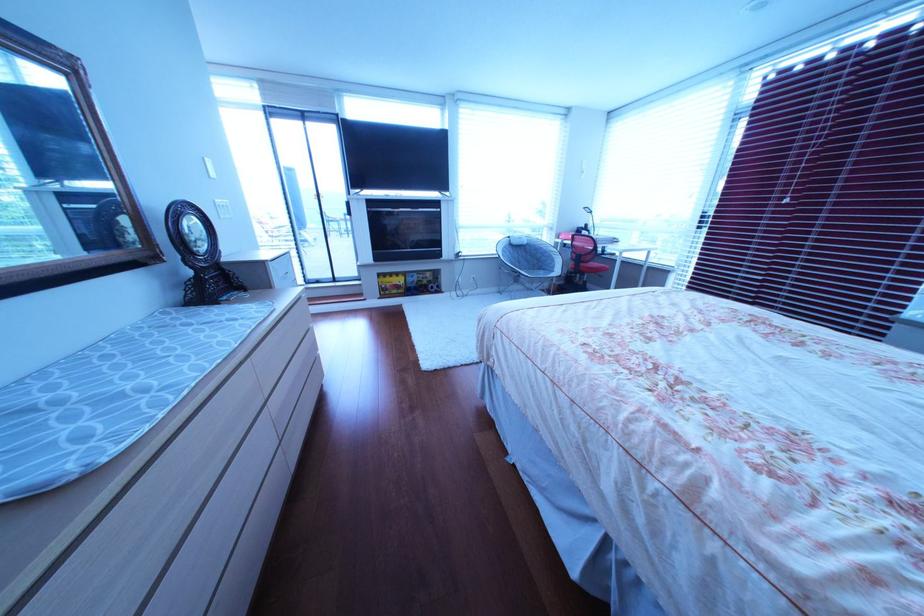
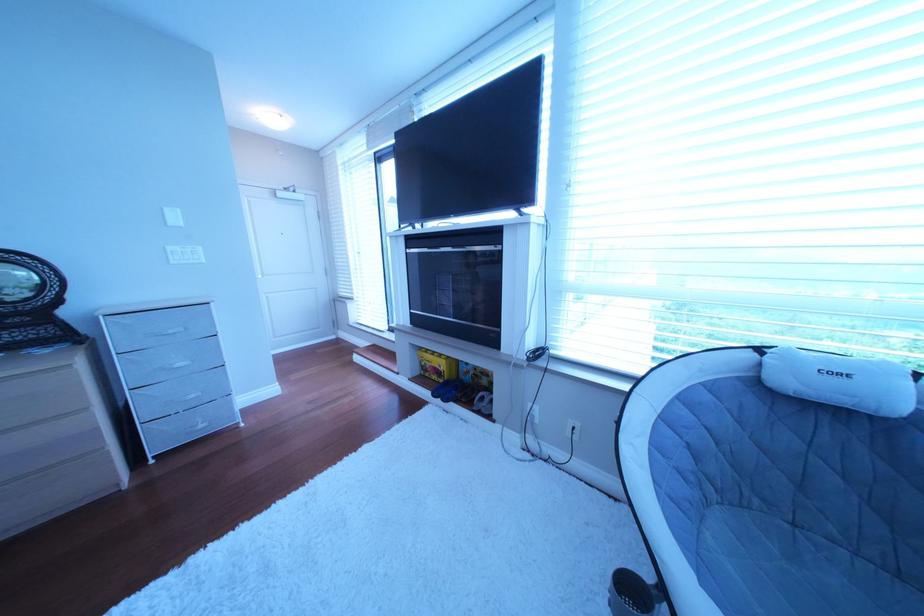
Where in the second image is the point corresponding to (410,293) from the first image?

(450, 379)